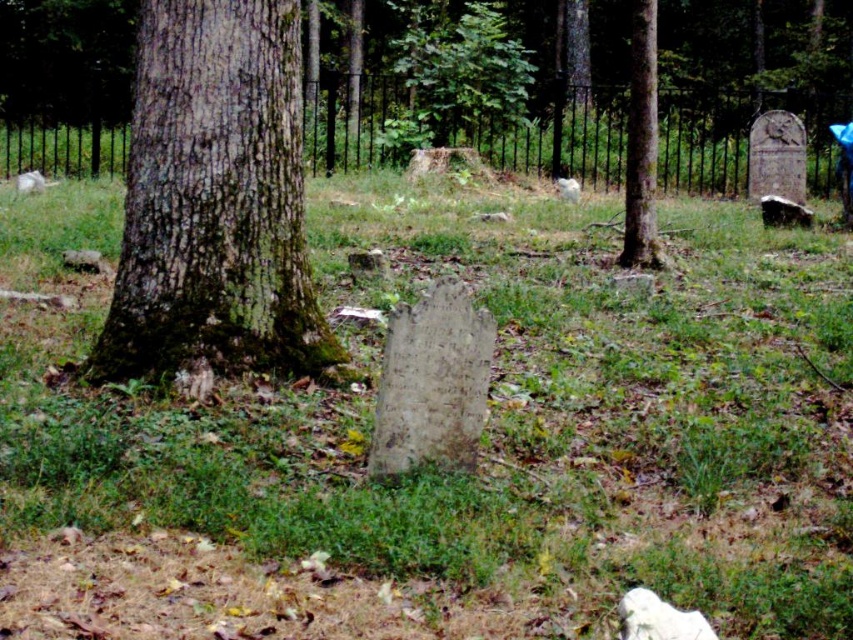
Who is shorter, green mossy bark tree at left or smooth bark tree at center?

With less height is green mossy bark tree at left.

What do you see at coordinates (213, 200) in the screenshot? The width and height of the screenshot is (853, 640). I see `green mossy bark tree at left` at bounding box center [213, 200].

Is point (164, 371) closer to viewer compared to point (645, 112)?

Yes, it is.

You are a GUI agent. You are given a task and a screenshot of the screen. Output one action in this format:
    pyautogui.click(x=<x>, y=<y>)
    Task: Click on the green mossy bark tree at left
    This screenshot has width=853, height=640.
    Given the screenshot: What is the action you would take?
    pyautogui.click(x=213, y=200)